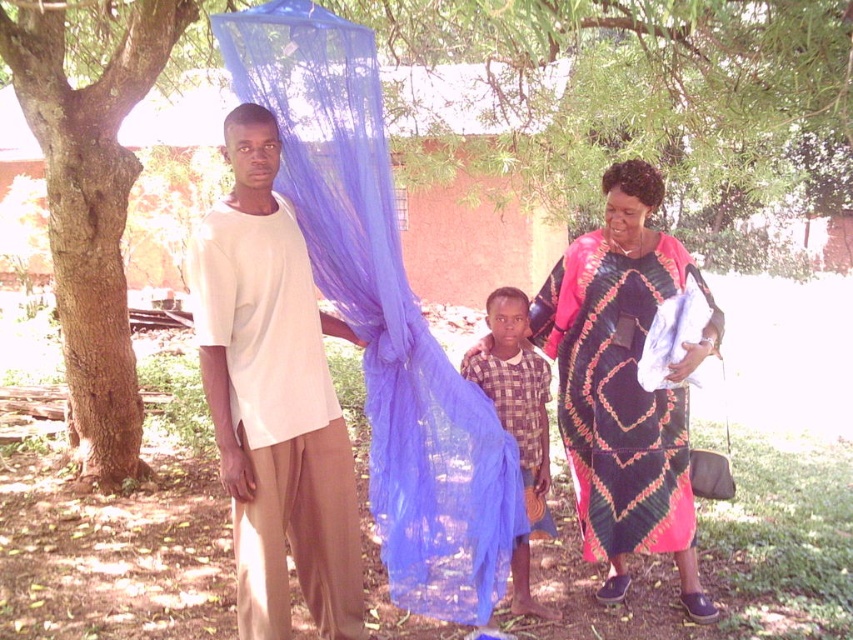
Question: Where is white matte t-shirt at center located in relation to printed cotton dress at center in the image?

Choices:
 (A) below
 (B) above

Answer: (B)

Question: Which point is farther to the camera?

Choices:
 (A) printed cotton dress at center
 (B) brown rough bark tree at left
 (C) checkered fabric shirt at center

Answer: (B)

Question: Among these points, which one is farthest from the camera?

Choices:
 (A) (538, 356)
 (B) (231, 204)
 (C) (585, 244)

Answer: (A)

Question: Does printed cotton dress at center appear on the right side of checkered fabric shirt at center?

Choices:
 (A) yes
 (B) no

Answer: (A)

Question: Is printed cotton dress at center smaller than checkered fabric shirt at center?

Choices:
 (A) yes
 (B) no

Answer: (B)

Question: Which is nearer to the white matte t-shirt at center?

Choices:
 (A) brown rough bark tree at left
 (B) printed cotton dress at center

Answer: (B)